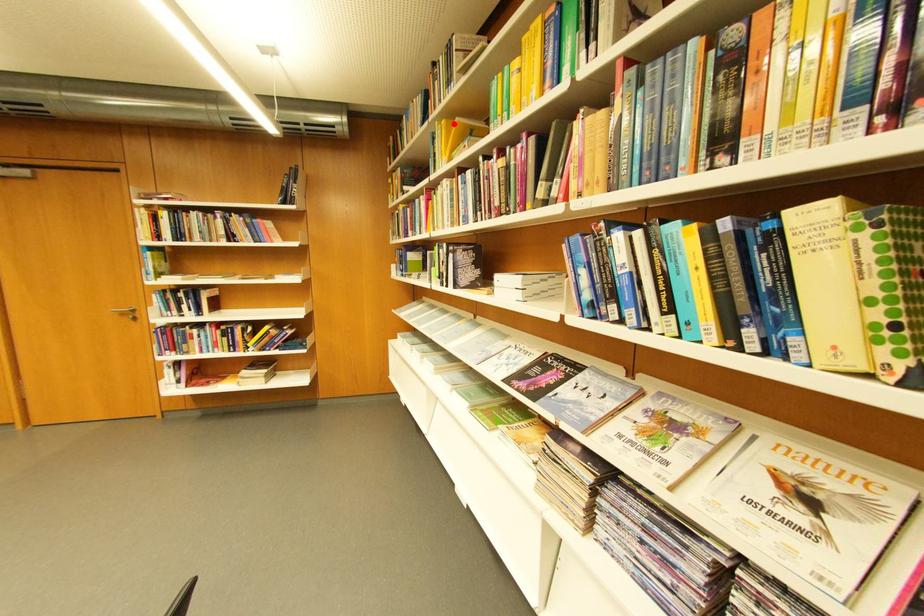
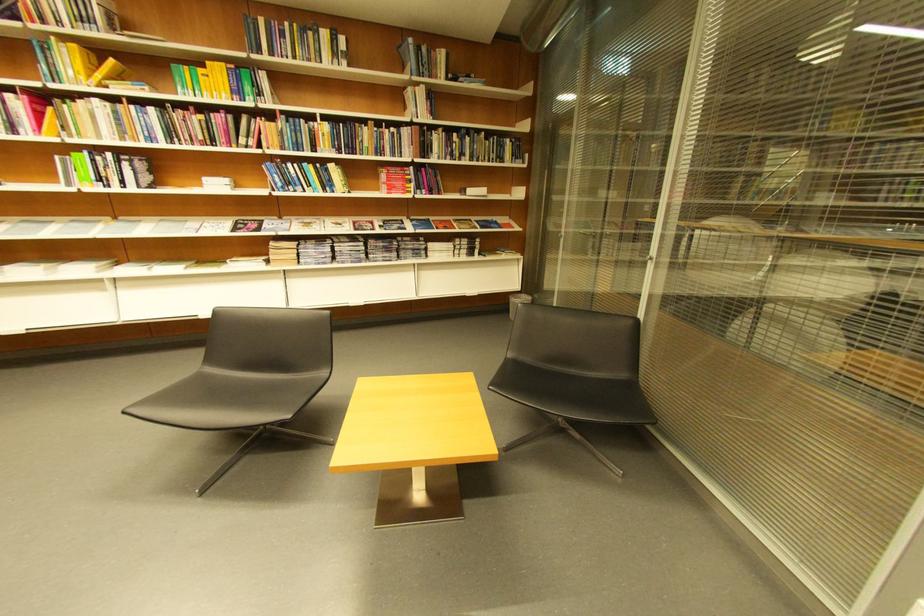
Question: I am providing you with two images of the same scene from different viewpoints. A red point is shown in image1. For the corresponding object point in image2, is it positioned nearer or farther from the camera?

Choices:
 (A) Nearer
 (B) Farther

Answer: (B)